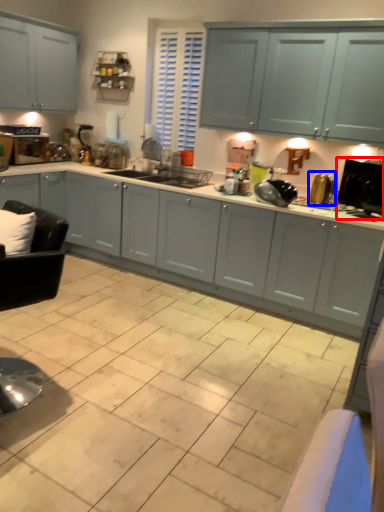
Question: Which object is closer to the camera taking this photo, appliance (highlighted by a red box) or appliance (highlighted by a blue box)?

Choices:
 (A) appliance
 (B) appliance

Answer: (A)